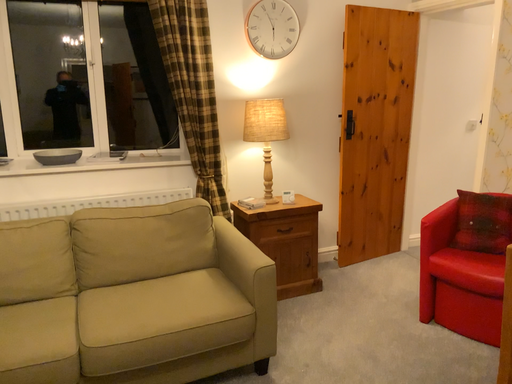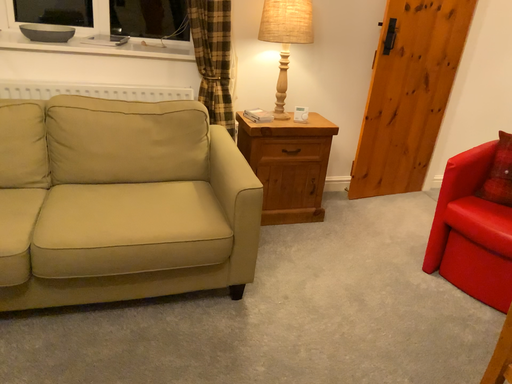
Question: How did the camera likely rotate when shooting the video?

Choices:
 (A) rotated downward
 (B) rotated upward

Answer: (A)